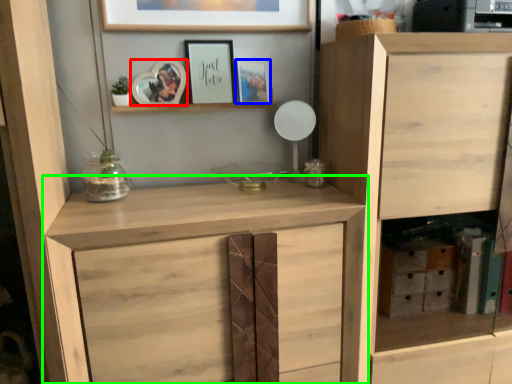
Question: Which is farther away from picture frame (highlighted by a red box)? picture frame (highlighted by a blue box) or cupboard (highlighted by a green box)?

Choices:
 (A) picture frame
 (B) cupboard

Answer: (B)